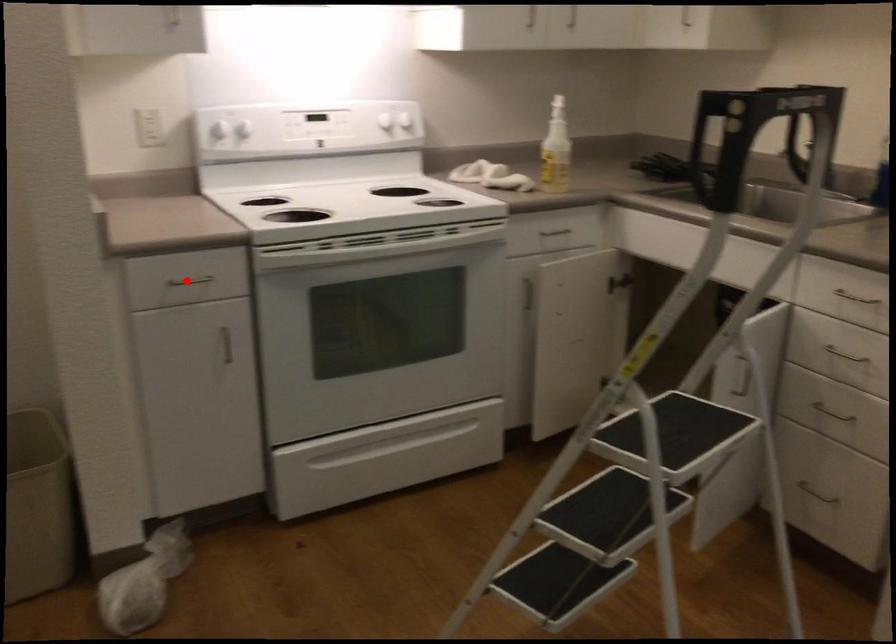
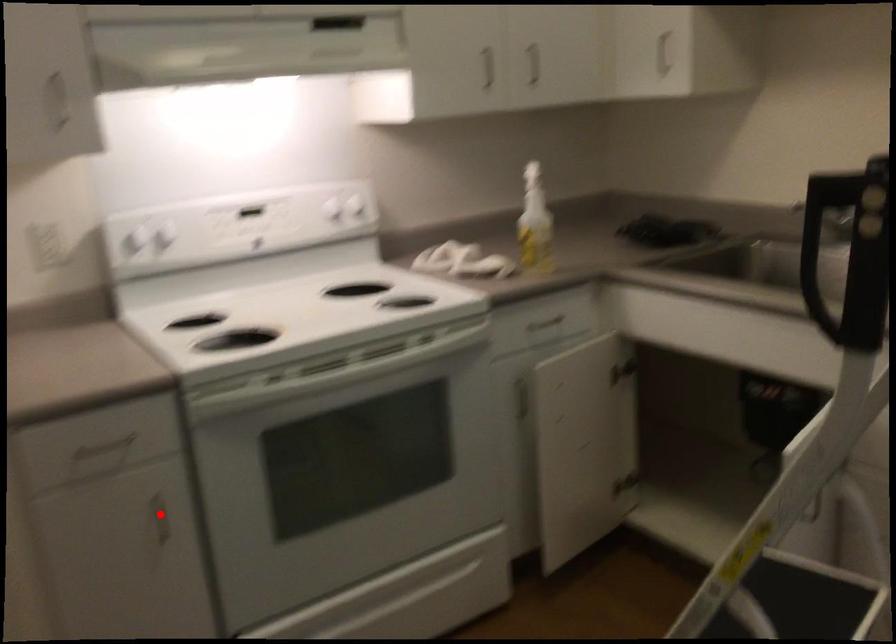
I am providing you with two images of the same scene from different viewpoints. A red point is marked on the first image and another point is marked on the second image. Is the red point in image1 aligned with the point shown in image2?

No